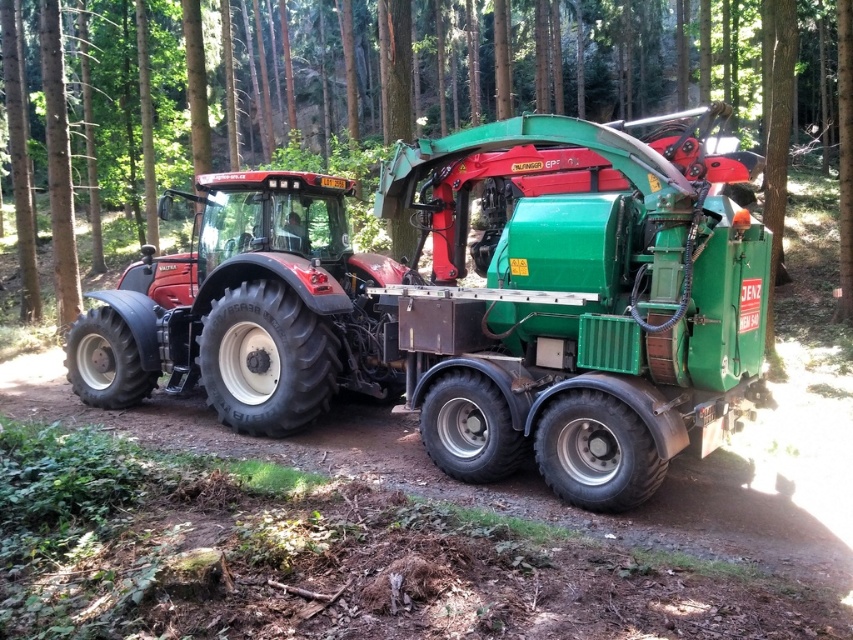
Between matte black tractor at center and green metallic truck at center, which one appears on the right side from the viewer's perspective?

matte black tractor at center is more to the right.

Image resolution: width=853 pixels, height=640 pixels. What are the coordinates of `matte black tractor at center` in the screenshot? It's located at (469, 304).

Where is `matte black tractor at center`? matte black tractor at center is located at coordinates (469, 304).